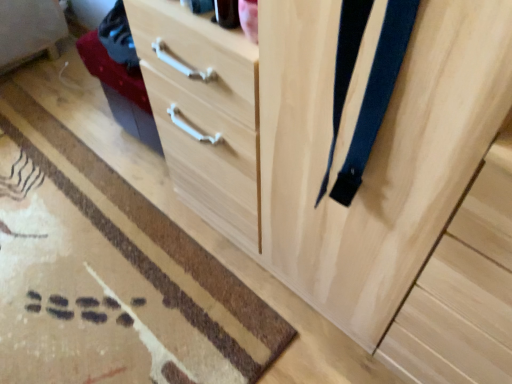
Question: Visually, is brown woven mat at lower left positioned to the left or to the right of dark blue fabric suspenders at right?

Choices:
 (A) right
 (B) left

Answer: (B)

Question: Is brown woven mat at lower left in front of or behind dark blue fabric suspenders at right in the image?

Choices:
 (A) behind
 (B) front

Answer: (A)

Question: Looking at the image, does brown woven mat at lower left seem bigger or smaller compared to dark blue fabric suspenders at right?

Choices:
 (A) small
 (B) big

Answer: (B)

Question: Is dark blue fabric suspenders at right to the left or to the right of brown woven mat at lower left in the image?

Choices:
 (A) left
 (B) right

Answer: (B)

Question: From the image's perspective, is dark blue fabric suspenders at right above or below brown woven mat at lower left?

Choices:
 (A) below
 (B) above

Answer: (B)

Question: In terms of height, does dark blue fabric suspenders at right look taller or shorter compared to brown woven mat at lower left?

Choices:
 (A) short
 (B) tall

Answer: (B)

Question: Choose the correct answer: Is dark blue fabric suspenders at right inside brown woven mat at lower left or outside it?

Choices:
 (A) outside
 (B) inside

Answer: (A)